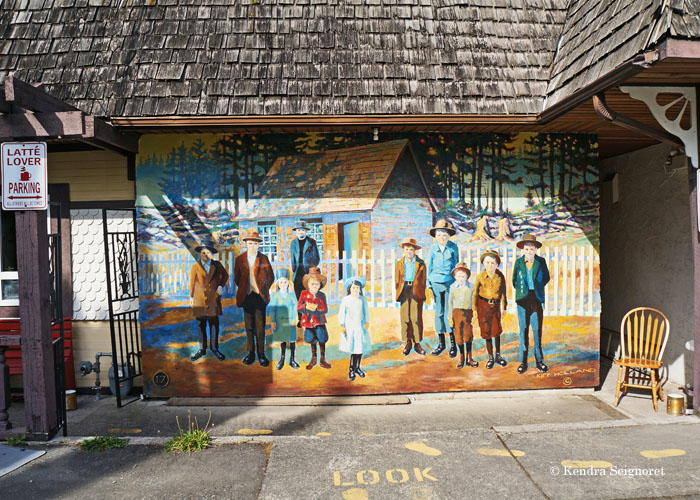
At what (x,y) coordinates should I click in order to perform the action: click on chair. Please return your answer as a coordinate pair (x, y). Looking at the image, I should click on (651, 345).